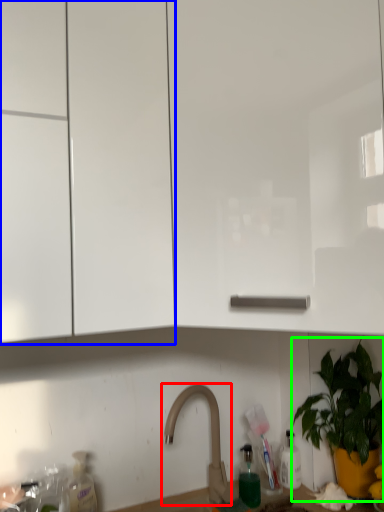
Question: Which object is the farthest from tap (highlighted by a red box)? Choose among these: cabinetry (highlighted by a blue box) or houseplant (highlighted by a green box).

Choices:
 (A) cabinetry
 (B) houseplant

Answer: (A)